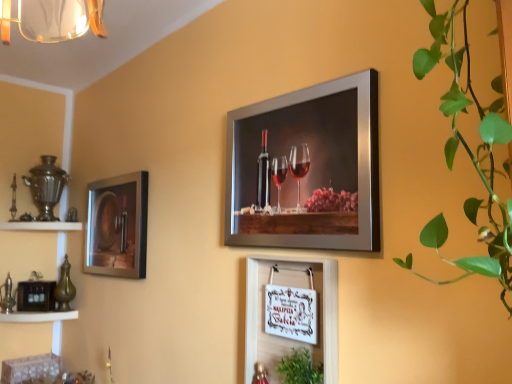
Find the location of a particular element. green leafy plant at right is located at coordinates (469, 156).

What do you see at coordinates (300, 368) in the screenshot? I see `green leafy plant at lower center` at bounding box center [300, 368].

Find the location of a particular element. The width and height of the screenshot is (512, 384). white wood shelf at lower left is located at coordinates (38, 316).

Is the position of white wood sign at center, which appears as the second picture frame when viewed from the front, more distant than that of white wood shelf at lower left?

No, white wood sign at center, which appears as the second picture frame when viewed from the front, is in front of white wood shelf at lower left.

Identify the location of shelf that appears below the white wood sign at center, which appears as the 2th picture frame when viewed from the left (from the image's perspective). This screenshot has width=512, height=384. (38, 316).

In terms of width, does white wood sign at center, the 2th picture frame positioned from the back, look wider or thinner when compared to white wood shelf at lower left?

Clearly, white wood sign at center, the 2th picture frame positioned from the back, has less width compared to white wood shelf at lower left.

Is white wood sign at center, marked as the second picture frame in a right-to-left arrangement, facing away from white wood shelf at lower left?

No.

Is white wood sign at center, the 2th picture frame positioned from the back, at the back of green leafy plant at lower center?

Correct, green leafy plant at lower center is looking away from white wood sign at center, the 2th picture frame positioned from the back.

Which is more to the right, green leafy plant at lower center or white wood sign at center, marked as the second picture frame in a right-to-left arrangement?

Positioned to the right is green leafy plant at lower center.

Considering the points (300, 380) and (254, 281), which point is in front, point (300, 380) or point (254, 281)?

Point (300, 380)

Does white wood shelf at lower left have a lesser height compared to green leafy plant at lower center?

Correct, white wood shelf at lower left is not as tall as green leafy plant at lower center.

Based on the photo, from the image's perspective, between white wood shelf at lower left and green leafy plant at lower center, who is located below?

white wood shelf at lower left, from the image's perspective.

Is white wood shelf at lower left located outside green leafy plant at lower center?

Indeed, white wood shelf at lower left is completely outside green leafy plant at lower center.

Based on their positions, is metallic silver wine bottle at left, the third picture frame in the right-to-left sequence, located to the left or right of metallic silver picture frame at upper center, positioned as the third picture frame in back-to-front order?

Clearly, metallic silver wine bottle at left, the third picture frame in the right-to-left sequence, is on the left of metallic silver picture frame at upper center, positioned as the third picture frame in back-to-front order, in the image.

Consider the image. Can metallic silver picture frame at upper center, the first picture frame when ordered from right to left, be found inside metallic silver wine bottle at left, which is counted as the first picture frame, starting from the left?

No, metallic silver picture frame at upper center, the first picture frame when ordered from right to left, is not inside metallic silver wine bottle at left, which is counted as the first picture frame, starting from the left.

From the image's perspective, between metallic silver wine bottle at left, which ranks as the 1th picture frame in back-to-front order, and metallic silver picture frame at upper center, the first picture frame when ordered from right to left, who is located below?

metallic silver wine bottle at left, which ranks as the 1th picture frame in back-to-front order, is shown below in the image.

Considering the sizes of metallic silver wine bottle at left, which ranks as the 1th picture frame in back-to-front order, and metallic silver picture frame at upper center, arranged as the first picture frame when viewed from the front, in the image, is metallic silver wine bottle at left, which ranks as the 1th picture frame in back-to-front order, taller or shorter than metallic silver picture frame at upper center, arranged as the first picture frame when viewed from the front,?

Clearly, metallic silver wine bottle at left, which ranks as the 1th picture frame in back-to-front order, is shorter compared to metallic silver picture frame at upper center, arranged as the first picture frame when viewed from the front.

From the image's perspective, is green leafy plant at right on metallic silver wine bottle at left, the third picture frame in the right-to-left sequence?

Yes, from the image's perspective, green leafy plant at right is over metallic silver wine bottle at left, the third picture frame in the right-to-left sequence.

Can you confirm if green leafy plant at right is positioned to the left of metallic silver wine bottle at left, which is counted as the first picture frame, starting from the left?

Incorrect, green leafy plant at right is not on the left side of metallic silver wine bottle at left, which is counted as the first picture frame, starting from the left.

Is white wood sign at center, marked as the second picture frame in a right-to-left arrangement, inside or outside of metallic silver picture frame at upper center, the first picture frame when ordered from right to left?

white wood sign at center, marked as the second picture frame in a right-to-left arrangement, exists outside the volume of metallic silver picture frame at upper center, the first picture frame when ordered from right to left.

Who is taller, white wood sign at center, marked as the second picture frame in a right-to-left arrangement, or metallic silver picture frame at upper center, the first picture frame when ordered from right to left?

Standing taller between the two is metallic silver picture frame at upper center, the first picture frame when ordered from right to left.

Is white wood sign at center, marked as the second picture frame in a right-to-left arrangement, positioned with its back to metallic silver picture frame at upper center, arranged as the first picture frame when viewed from the front?

No.

From a real-world perspective, is white wood sign at center, marked as the second picture frame in a right-to-left arrangement, physically located above or below metallic silver picture frame at upper center, the first picture frame when ordered from right to left?

From a real-world perspective, white wood sign at center, marked as the second picture frame in a right-to-left arrangement, is physically below metallic silver picture frame at upper center, the first picture frame when ordered from right to left.

In terms of height, does green leafy plant at lower center look taller or shorter compared to white wood shelf at lower left?

green leafy plant at lower center is taller than white wood shelf at lower left.

Considering the positions of objects green leafy plant at lower center and white wood shelf at lower left in the image provided, who is more to the left, green leafy plant at lower center or white wood shelf at lower left?

Positioned to the left is white wood shelf at lower left.

Between green leafy plant at lower center and white wood shelf at lower left, which one has larger size?

With larger size is white wood shelf at lower left.

Find the location of a particular element. shelf below the white wood sign at center, which appears as the second picture frame when viewed from the front (from a real-world perspective) is located at coordinates (38, 316).

From the green leafy plant at lower center, count the 2nd picture frame to the left and point to it. Please provide its 2D coordinates.

[(286, 338)]

When comparing their distances from green leafy plant at right, does white wood sign at center, the 2th picture frame positioned from the back, or metallic silver wine bottle at left, the third picture frame in the right-to-left sequence, seem closer?

The object closer to green leafy plant at right is white wood sign at center, the 2th picture frame positioned from the back.

Considering their positions, is white wood shelf at lower left positioned closer to green leafy plant at right than green leafy plant at lower center?

green leafy plant at lower center is closer to green leafy plant at right.

Considering their positions, is green leafy plant at right positioned further to green leafy plant at lower center than white wood shelf at lower left?

Based on the image, white wood shelf at lower left appears to be further to green leafy plant at lower center.

When comparing their distances from green leafy plant at lower center, does white wood shelf at lower left or white wood sign at center, the 2th picture frame positioned from the back, seem closer?

The object closer to green leafy plant at lower center is white wood sign at center, the 2th picture frame positioned from the back.

Based on the photo, based on their spatial positions, is green leafy plant at lower center or metallic silver picture frame at upper center, arranged as the first picture frame when viewed from the front, further from white wood shelf at lower left?

metallic silver picture frame at upper center, arranged as the first picture frame when viewed from the front.

Based on their spatial positions, is metallic silver picture frame at upper center, the first picture frame when ordered from right to left, or green leafy plant at lower center further from white wood shelf at lower left?

metallic silver picture frame at upper center, the first picture frame when ordered from right to left, is positioned further to the anchor white wood shelf at lower left.

From the image, which object appears to be nearer to metallic silver picture frame at upper center, the first picture frame when ordered from right to left, green leafy plant at lower center or green leafy plant at right?

green leafy plant at right.

From the image, which object appears to be nearer to green leafy plant at lower center, white wood sign at center, the 2th picture frame positioned from the back, or white wood shelf at lower left?

white wood sign at center, the 2th picture frame positioned from the back, is positioned closer to the anchor green leafy plant at lower center.

Find the location of `plant between white wood shelf at lower left and green leafy plant at right in the horizontal direction`. plant between white wood shelf at lower left and green leafy plant at right in the horizontal direction is located at coordinates (300, 368).

You are a GUI agent. You are given a task and a screenshot of the screen. Output one action in this format:
    pyautogui.click(x=<x>, y=<y>)
    Task: Click on the picture frame situated between metallic silver wine bottle at left, which appears as the 3th picture frame when viewed from the front, and metallic silver picture frame at upper center, the first picture frame when ordered from right to left, from left to right
    
    Given the screenshot: What is the action you would take?
    point(286,338)

The image size is (512, 384). What are the coordinates of `picture frame between white wood shelf at lower left and white wood sign at center, marked as the second picture frame in a right-to-left arrangement` in the screenshot? It's located at (117, 226).

This screenshot has width=512, height=384. In order to click on plant between green leafy plant at right and metallic silver wine bottle at left, which is counted as the first picture frame, starting from the left, along the z-axis in this screenshot , I will do `click(300, 368)`.